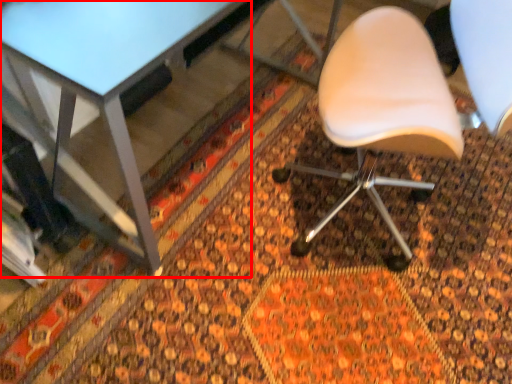
Question: From the image's perspective, what is the correct spatial relationship of table (annotated by the red box) in relation to chair?

Choices:
 (A) below
 (B) above

Answer: (B)